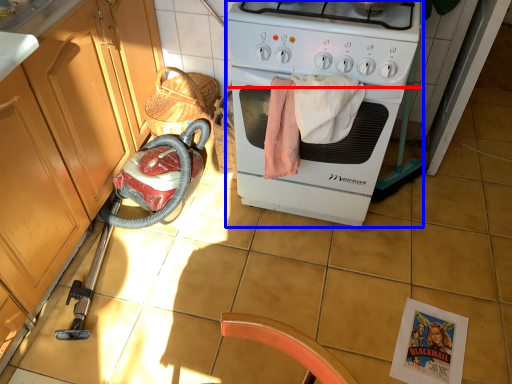
Question: Among these objects, which one is nearest to the camera, gas stove (highlighted by a red box) or home appliance (highlighted by a blue box)?

Choices:
 (A) gas stove
 (B) home appliance

Answer: (A)